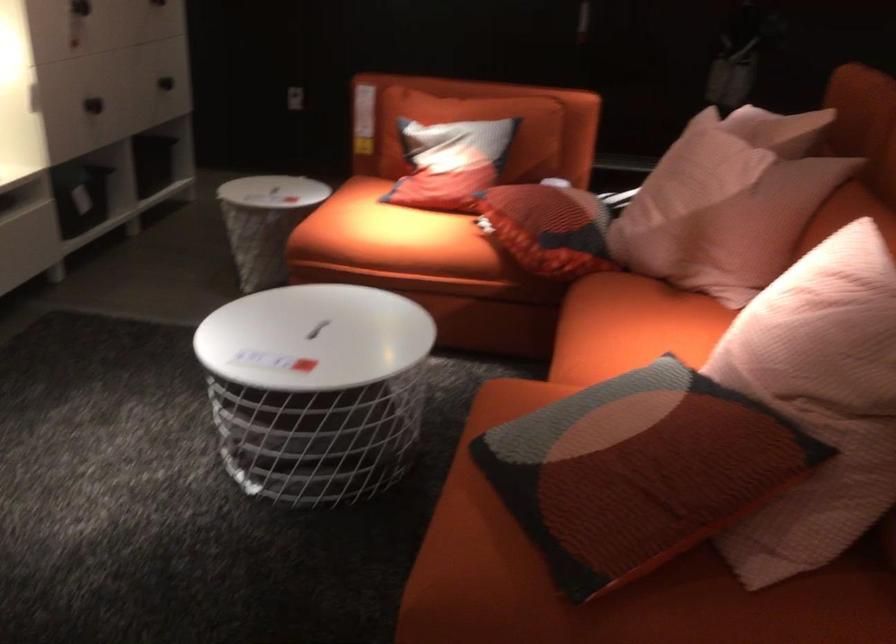
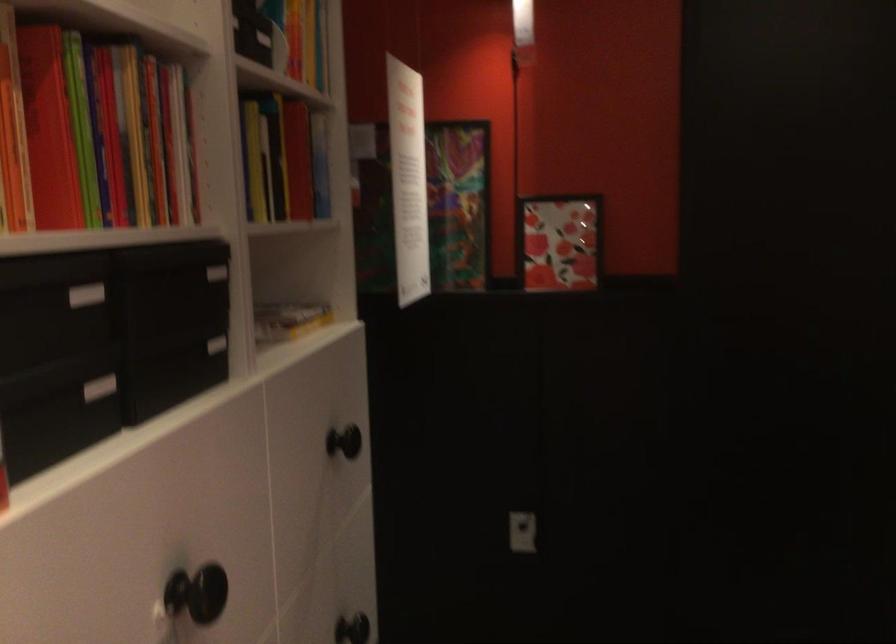
What movement of the cameraman would produce the second image?

The cameraman walked toward left, forward.